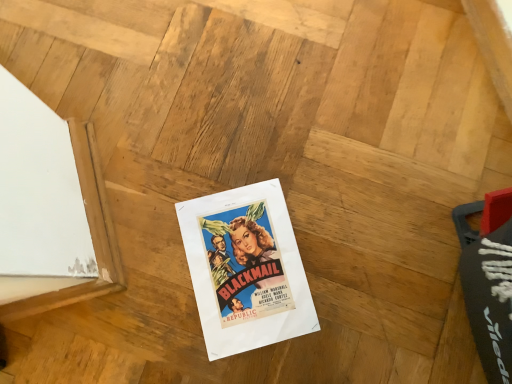
Locate an element on the screen. The image size is (512, 384). free point behind matte paper poster at center is located at coordinates (263, 155).